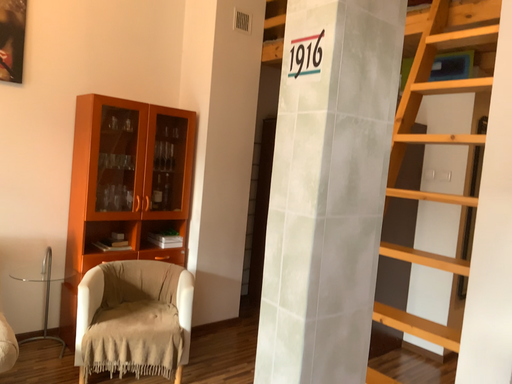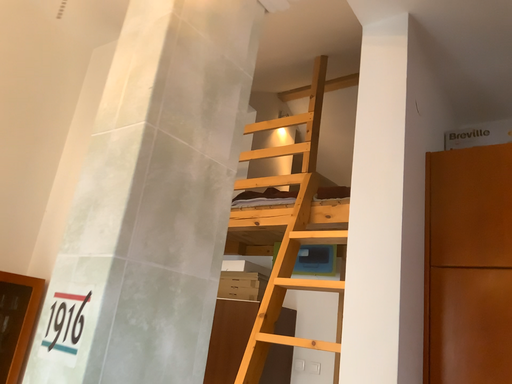
Question: Which way did the camera rotate in the video?

Choices:
 (A) rotated right
 (B) rotated left

Answer: (A)